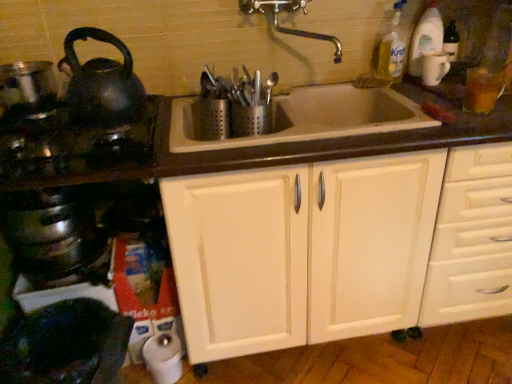
Locate an element on the screen. space that is in front of white plastic bottle at upper right, which ranks as the 1th bottle in right-to-left order is located at coordinates (434, 89).